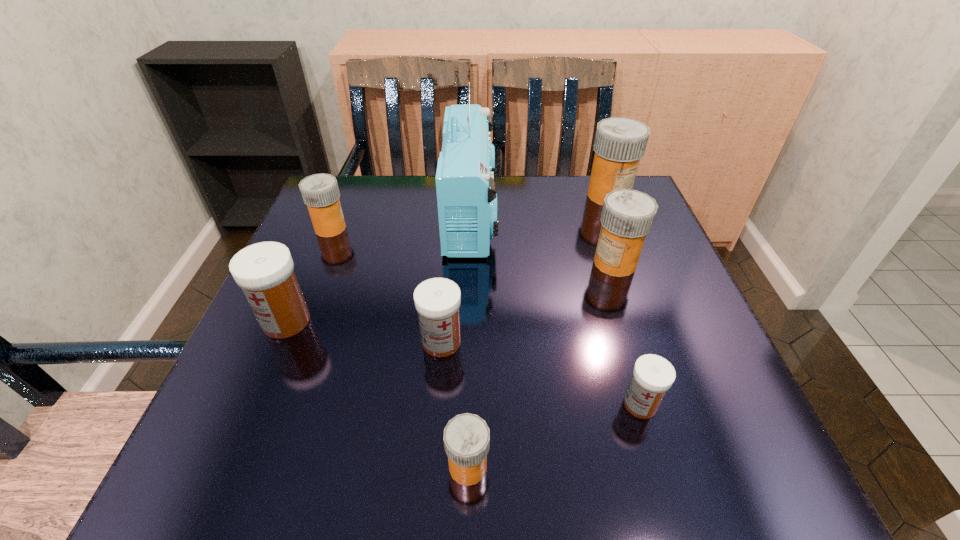
This screenshot has height=540, width=960. Find the location of `radio receiver`. radio receiver is located at coordinates (465, 178).

This screenshot has height=540, width=960. What are the coordinates of `the tallest object` in the screenshot? It's located at (465, 178).

The height and width of the screenshot is (540, 960). What are the coordinates of `the biggest orange medicine` in the screenshot? It's located at (620, 143).

The height and width of the screenshot is (540, 960). Identify the location of the tallest medicine. (620, 143).

Where is `the second biggest orange medicine`? the second biggest orange medicine is located at coordinates (627, 216).

Find the location of a particular element. This screenshot has height=540, width=960. the fifth nearest medicine is located at coordinates (627, 216).

The width and height of the screenshot is (960, 540). In order to click on the leftmost white medicine in this screenshot , I will do `click(264, 271)`.

Identify the location of the leftmost orange medicine. This screenshot has width=960, height=540. pyautogui.click(x=320, y=192).

This screenshot has height=540, width=960. I want to click on the second smallest orange medicine, so (x=320, y=192).

The width and height of the screenshot is (960, 540). In order to click on the second white medicine from right to left in this screenshot , I will do `click(437, 300)`.